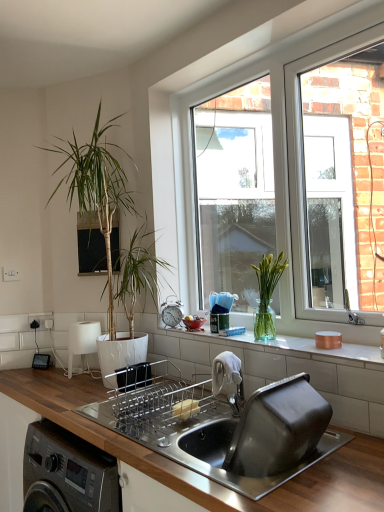
This screenshot has height=512, width=384. Describe the element at coordinates (90, 245) in the screenshot. I see `black glass window screen at upper left` at that location.

This screenshot has width=384, height=512. Describe the element at coordinates (82, 344) in the screenshot. I see `white matte lamp at left, positioned as the 1th appliance in bottom-to-top order` at that location.

Find the location of `stainless steel sink at center`. stainless steel sink at center is located at coordinates (246, 434).

This screenshot has height=512, width=384. What do you see at coordinates (171, 312) in the screenshot?
I see `silver metallic alarm clock at upper center, which is the second appliance from left to right` at bounding box center [171, 312].

In order to click on clear glass window at center in this screenshot , I will do `click(274, 182)`.

Locate an element on the screen. This screenshot has width=384, height=512. black glass window screen at upper left is located at coordinates (90, 245).

Could you tell me if white matte tap at center is turned towards green leafy plant at left, arranged as the 1th houseplant when viewed from the left?

No, white matte tap at center is not turned towards green leafy plant at left, arranged as the 1th houseplant when viewed from the left.

This screenshot has height=512, width=384. Identify the location of tap that is in front of the green leafy plant at left, the second houseplant when ordered from front to back. (228, 380).

From the image's perspective, is white matte tap at center positioned above or below green leafy plant at left, arranged as the 1th houseplant when viewed from the left?

white matte tap at center is situated lower than green leafy plant at left, arranged as the 1th houseplant when viewed from the left, in the image.

Looking at this image, from a real-world perspective, which object stands above the other?

In real-world perspective, green glass vase at window, the 2th houseplant when ordered from back to front, is above.

Between point (272, 321) and point (293, 447), which one is positioned behind?

The point (272, 321) is farther.

Would you consider green glass vase at window, placed as the second houseplant when sorted from left to right, to be distant from stainless steel sink at center?

They are positioned close to each other.

Can you tell me how much clear glass window at center and clear glass vase at center differ in facing direction?

clear glass window at center and clear glass vase at center are facing 0.465 degrees away from each other.

Locate an element on the screen. This screenshot has width=384, height=512. window that is above the clear glass vase at center (from the image's perspective) is located at coordinates (274, 182).

Is clear glass vase at center completely or partially inside clear glass window at center?

No, clear glass vase at center is not inside clear glass window at center.

Does clear glass window at center have a greater height compared to clear glass vase at center?

Yes.

Which of these two, silver metallic alarm clock at upper center, the first appliance viewed from the top, or black glass window screen at upper left, is smaller?

silver metallic alarm clock at upper center, the first appliance viewed from the top, is smaller.

Between point (169, 321) and point (81, 221), which one is positioned behind?

The point (81, 221) is more distant.

Is silver metallic alarm clock at upper center, which is the second appliance in back-to-front order, spatially inside black glass window screen at upper left, or outside of it?

silver metallic alarm clock at upper center, which is the second appliance in back-to-front order, is spatially situated outside black glass window screen at upper left.

Between silver metallic alarm clock at upper center, which is counted as the 2th appliance, starting from the bottom, and stainless steel sink at center, which one is positioned in front?

Positioned in front is stainless steel sink at center.

Is stainless steel sink at center inside silver metallic alarm clock at upper center, the 1th appliance from the front?

Actually, stainless steel sink at center is outside silver metallic alarm clock at upper center, the 1th appliance from the front.

Is silver metallic alarm clock at upper center, which is the second appliance in back-to-front order, wider than stainless steel sink at center?

Incorrect, the width of silver metallic alarm clock at upper center, which is the second appliance in back-to-front order, does not surpass that of stainless steel sink at center.

From the image's perspective, relative to stainless steel sink at center, is silver metallic alarm clock at upper center, which is the second appliance in back-to-front order, above or below?

Clearly, from the image's perspective, silver metallic alarm clock at upper center, which is the second appliance in back-to-front order, is above stainless steel sink at center.

Is wooden countertop at lower center surrounding green leafy plant at left, arranged as the 1th houseplant when viewed from the left?

That's incorrect, green leafy plant at left, arranged as the 1th houseplant when viewed from the left, is not inside wooden countertop at lower center.

From the image's perspective, between wooden countertop at lower center and green leafy plant at left, which is counted as the first houseplant, starting from the back, who is located below?

wooden countertop at lower center is shown below in the image.

I want to click on the 2nd houseplant positioned above the wooden countertop at lower center (from the image's perspective), so click(x=97, y=189).

This screenshot has height=512, width=384. Find the location of `houseplant on the right of white matte tap at center`. houseplant on the right of white matte tap at center is located at coordinates (267, 295).

Can you tell me how much green glass vase at window, the first houseplant in the front-to-back sequence, and white matte tap at center differ in facing direction?

The angular difference between green glass vase at window, the first houseplant in the front-to-back sequence, and white matte tap at center is 23 degrees.

Does point (281, 255) come farther from viewer compared to point (216, 375)?

Yes, point (281, 255) is farther from viewer.

Where is `the 2nd houseplant above when counting from the white matte tap at center (from the image's perspective)`? the 2nd houseplant above when counting from the white matte tap at center (from the image's perspective) is located at coordinates (97, 189).

I want to click on sink below the green glass vase at window, the first houseplant in the front-to-back sequence (from a real-world perspective), so click(246, 434).

Considering their positions, is white matte tap at center positioned closer to white matte lamp at left, the 2th appliance when ordered from right to left, than green glass vase at window, the first houseplant in the front-to-back sequence?

Based on the image, white matte tap at center appears to be nearer to white matte lamp at left, the 2th appliance when ordered from right to left.

From the image, which object appears to be nearer to black glass window screen at upper left, stainless steel sink at center or clear glass window at center?

Among the two, clear glass window at center is located nearer to black glass window screen at upper left.

When comparing their distances from wooden countertop at lower center, does green leafy plant at left, arranged as the 1th houseplant when viewed from the left, or black glass window screen at upper left seem further?

The object further to wooden countertop at lower center is green leafy plant at left, arranged as the 1th houseplant when viewed from the left.

Based on their spatial positions, is clear glass window at center or wooden countertop at lower center further from green leafy plant at left, the 2th houseplant in the right-to-left sequence?

The object further to green leafy plant at left, the 2th houseplant in the right-to-left sequence, is wooden countertop at lower center.

Considering their positions, is white matte tap at center positioned further to silver metallic alarm clock at upper center, the first appliance viewed from the top, than black glass window screen at upper left?

white matte tap at center.

Looking at the image, which one is located further to clear glass window at center, white matte tap at center or clear glass vase at center?

white matte tap at center.

Looking at the image, which one is located further to white matte tap at center, silver metallic alarm clock at upper center, which is the second appliance from left to right, or white matte lamp at left, positioned as the 1th appliance in bottom-to-top order?

Based on the image, white matte lamp at left, positioned as the 1th appliance in bottom-to-top order, appears to be further to white matte tap at center.

When comparing their distances from silver metallic alarm clock at upper center, the first appliance viewed from the right, does clear glass vase at center or green leafy plant at left, the 2th houseplant in the right-to-left sequence, seem further?

The object further to silver metallic alarm clock at upper center, the first appliance viewed from the right, is green leafy plant at left, the 2th houseplant in the right-to-left sequence.

Identify the location of houseplant between black glass window screen at upper left and silver metallic alarm clock at upper center, which is counted as the 2th appliance, starting from the bottom, from left to right. The image size is (384, 512). (97, 189).

Image resolution: width=384 pixels, height=512 pixels. What are the coordinates of `appliance between black glass window screen at upper left and white matte lamp at left, the first appliance positioned from the left, in the up-down direction` in the screenshot? It's located at (171, 312).

The width and height of the screenshot is (384, 512). I want to click on houseplant located between black glass window screen at upper left and green glass vase at window, the first houseplant in the front-to-back sequence, in the left-right direction, so click(97, 189).

Where is `window sill between green leafy plant at left, the 2th houseplant in the right-to-left sequence, and green glass vase at window, the first houseplant in the front-to-back sequence, from left to right`? This screenshot has height=512, width=384. window sill between green leafy plant at left, the 2th houseplant in the right-to-left sequence, and green glass vase at window, the first houseplant in the front-to-back sequence, from left to right is located at coordinates (290, 347).